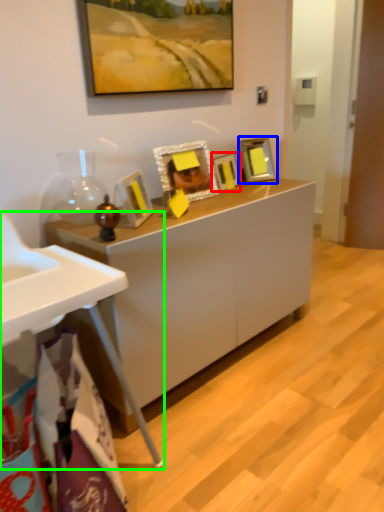
Question: Which object is the farthest from picture frame (highlighted by a red box)? Choose among these: picture frame (highlighted by a blue box) or table (highlighted by a green box).

Choices:
 (A) picture frame
 (B) table

Answer: (B)